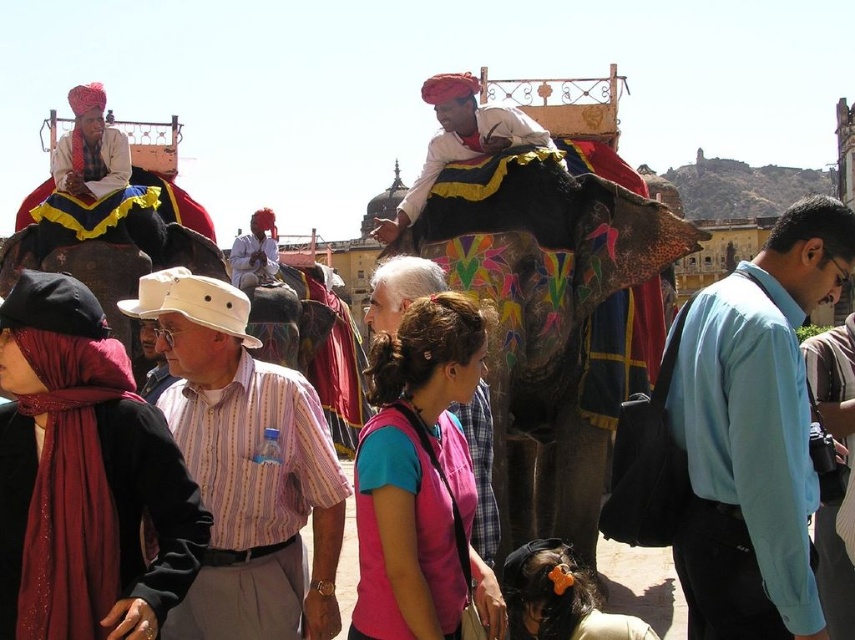
Identify the location of dark brown hair at lower center. The width and height of the screenshot is (855, 640). (559, 596).

Does point (544, 598) lie behind point (447, 76)?

No, (544, 598) is closer to viewer.

Locate an element on the screen. The image size is (855, 640). dark brown hair at lower center is located at coordinates (559, 596).

Is light blue shirt at center positioned in front of striped cotton shirt at center?

That is True.

Looking at this image, which of these two, light blue shirt at center or striped cotton shirt at center, stands taller?

With more height is light blue shirt at center.

Who is more distant from viewer, (x=773, y=444) or (x=270, y=420)?

The point (x=270, y=420) is behind.

This screenshot has height=640, width=855. Find the location of `light blue shirt at center`. light blue shirt at center is located at coordinates (753, 433).

Does point (446, 582) come in front of point (435, 106)?

Yes, point (446, 582) is in front of point (435, 106).

Does pink fabric shirt at center have a greater width compared to matte white shirt at center?

No, pink fabric shirt at center is not wider than matte white shirt at center.

Which is in front, point (397, 417) or point (444, 90)?

Point (397, 417) is in front.

Identify the location of pink fabric shirt at center. (420, 481).